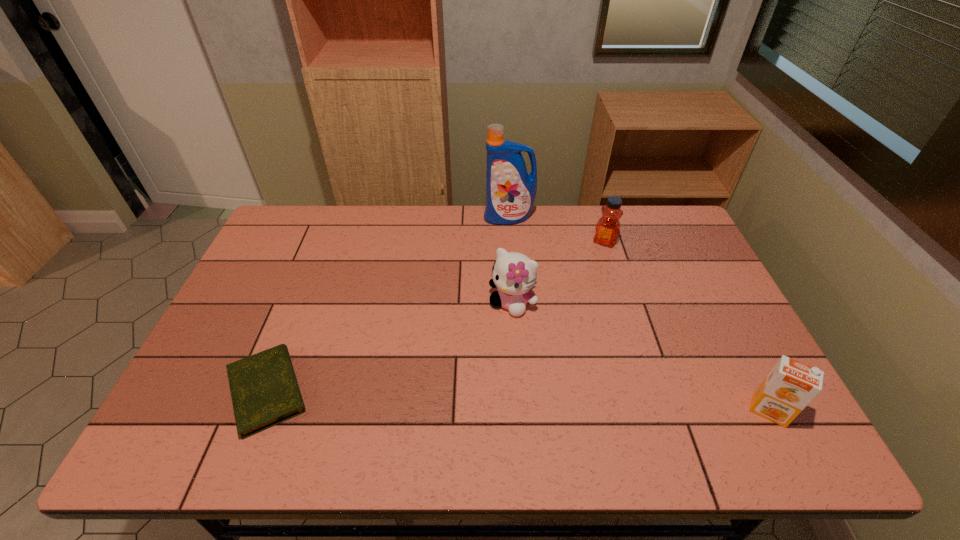
Identify the location of free space on the desktop that is between the shortest object and the rightmost object and is positioned on the front-facing side of the third farthest object. This screenshot has width=960, height=540. (441, 397).

Locate an element on the screen. This screenshot has height=540, width=960. vacant spot on the desktop that is between the diary and the rightmost object and is positioned on the front label of the fourth object from left to right is located at coordinates (515, 400).

I want to click on free spot on the desktop that is between the diary and the rightmost object and is positioned on the label of the tallest object, so click(x=481, y=399).